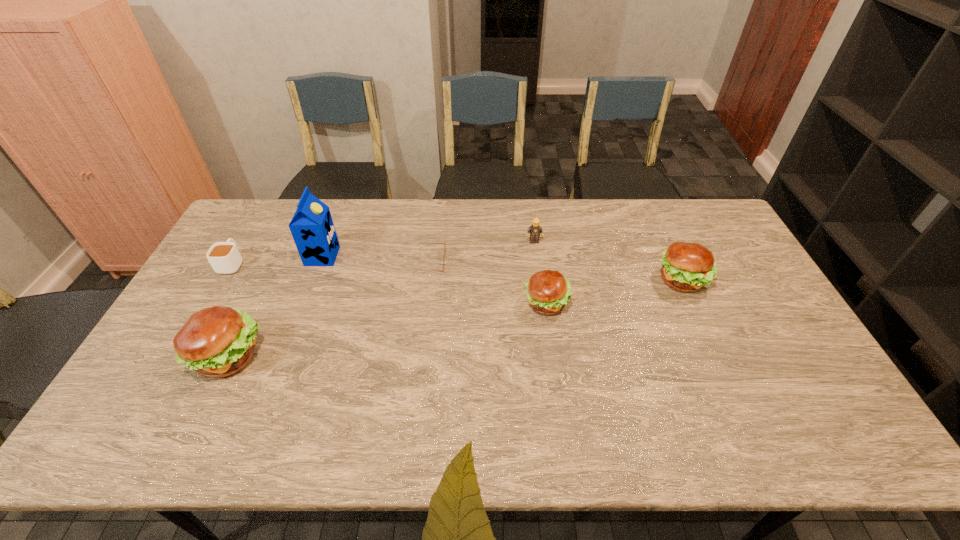
Find the location of a particular element. The image size is (960, 540). the nearest hamburger is located at coordinates (218, 341).

Identify the location of the second object from left to right. (218, 341).

This screenshot has height=540, width=960. Find the location of `the shortest hamburger`. the shortest hamburger is located at coordinates coord(548,291).

What are the coordinates of `the rightmost hamburger` in the screenshot? It's located at (687, 267).

Where is `the second shortest hamburger`? This screenshot has height=540, width=960. the second shortest hamburger is located at coordinates (687, 267).

Where is `the sixth tallest object`? The image size is (960, 540). the sixth tallest object is located at coordinates (224, 257).

Identify the location of cup. The width and height of the screenshot is (960, 540). (224, 257).

Where is `the tallest object`? The width and height of the screenshot is (960, 540). the tallest object is located at coordinates (312, 228).

Image resolution: width=960 pixels, height=540 pixels. I want to click on carton, so click(x=312, y=228).

The image size is (960, 540). I want to click on sunglasses, so click(419, 243).